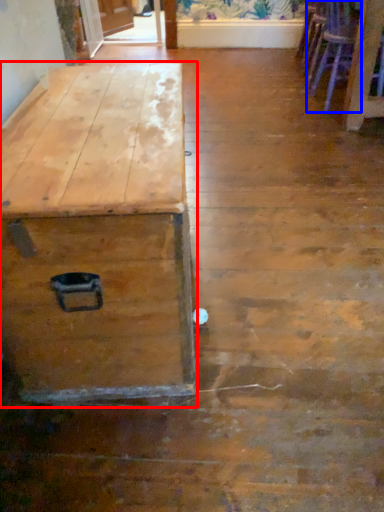
Question: Which object appears closest to the camera in this image, table (highlighted by a red box) or armchair (highlighted by a blue box)?

Choices:
 (A) table
 (B) armchair

Answer: (A)